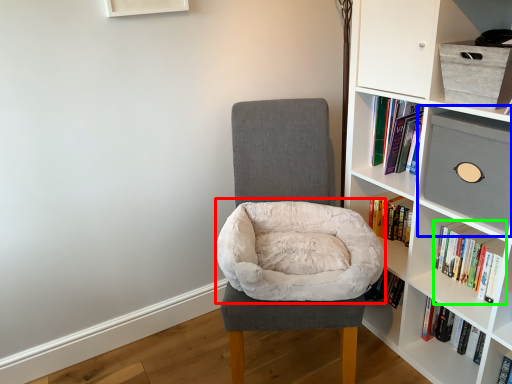
Question: Which is nearer to the bean bag chair (highlighted by a red box)? shelf (highlighted by a blue box) or book (highlighted by a green box).

Choices:
 (A) shelf
 (B) book

Answer: (A)